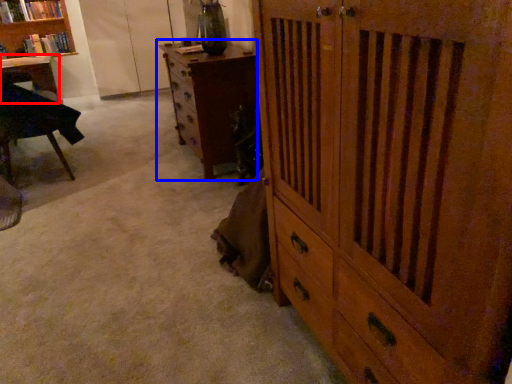
Question: Which object is further to the camera taking this photo, desk (highlighted by a red box) or chest of drawers (highlighted by a blue box)?

Choices:
 (A) desk
 (B) chest of drawers

Answer: (A)